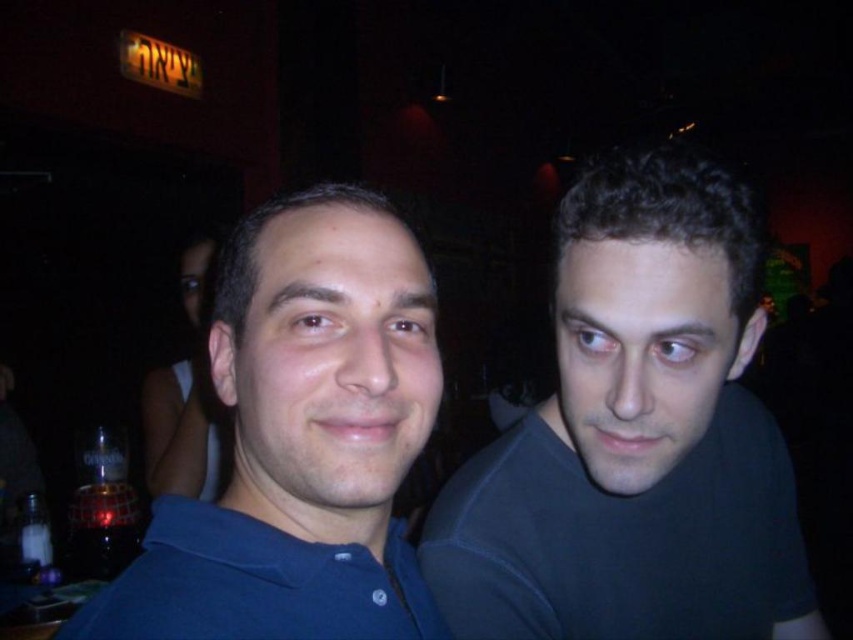
You are a photographer trying to capture a group photo of the dark blue shirt at right and the blue matte shirt at center. The camera can only focus on one person at a time. Which person should you focus on first to ensure their full body fits in the frame?

The dark blue shirt at right is wider than the blue matte shirt at center, so you should focus on the dark blue shirt at right first to ensure their full body fits in the frame.

You are standing in a dimly lit indoor space, possibly a bar or restaurant. You see a point at coordinates (x=556, y=282). If you want to place a 10 inch wide object at that point, will there be enough space?

The point at (x=556, y=282) is 22.31 inches away from you. Since the object is only 10 inches wide, there is enough space to place it there.

You are a photographer setting up for a group photo. You have two subjects wearing the dark blue shirt at right and blue matte shirt at center. Given their heights, which subject should stand in the back row to ensure both are visible in the photo?

The dark blue shirt at right is much taller than the blue matte shirt at center, so the dark blue shirt at right should stand in the back row to ensure both are visible in the photo.